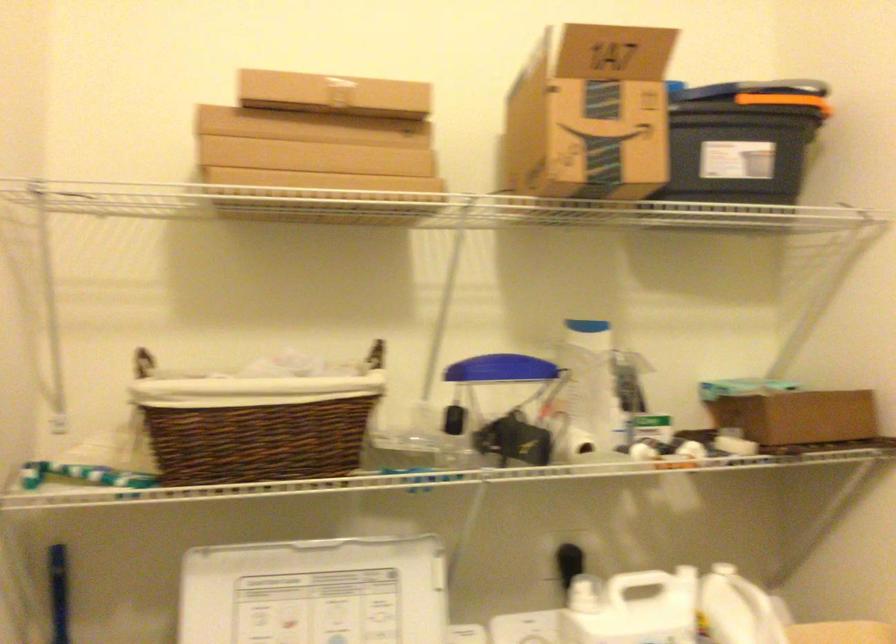
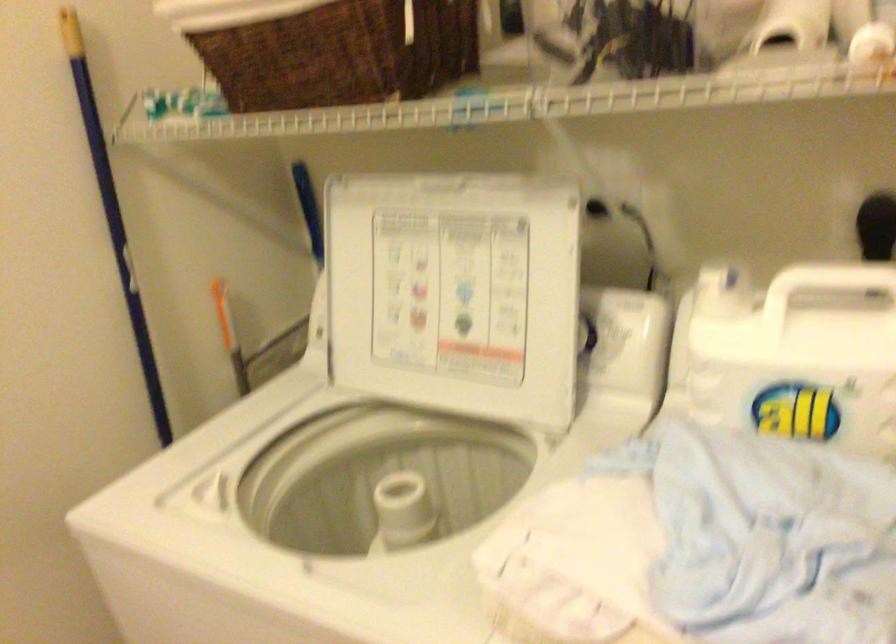
In the second image, find the point that corresponds to pixel 314 440 in the first image.

(340, 53)